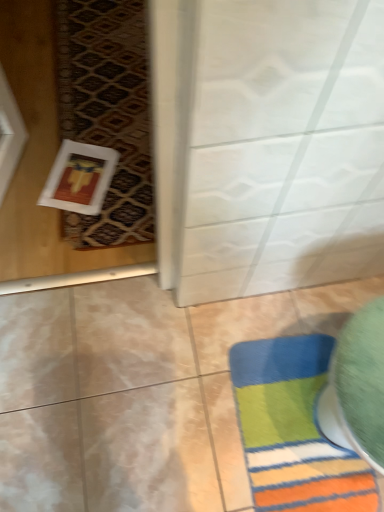
Question: Is white textured mat at left wider or thinner than multicolored plush bath mat at lower right?

Choices:
 (A) wide
 (B) thin

Answer: (A)

Question: Does point (82, 12) appear closer or farther from the camera than point (230, 359)?

Choices:
 (A) farther
 (B) closer

Answer: (A)

Question: Would you say white textured mat at left is inside or outside multicolored plush bath mat at lower right?

Choices:
 (A) inside
 (B) outside

Answer: (B)

Question: Considering the positions of multicolored plush bath mat at lower right and white textured mat at left in the image, is multicolored plush bath mat at lower right wider or thinner than white textured mat at left?

Choices:
 (A) thin
 (B) wide

Answer: (A)

Question: From a real-world perspective, is multicolored plush bath mat at lower right above or below white textured mat at left?

Choices:
 (A) below
 (B) above

Answer: (A)

Question: Is multicolored plush bath mat at lower right taller or shorter than white textured mat at left?

Choices:
 (A) short
 (B) tall

Answer: (B)

Question: From the image's perspective, is multicolored plush bath mat at lower right located above or below white textured mat at left?

Choices:
 (A) below
 (B) above

Answer: (A)